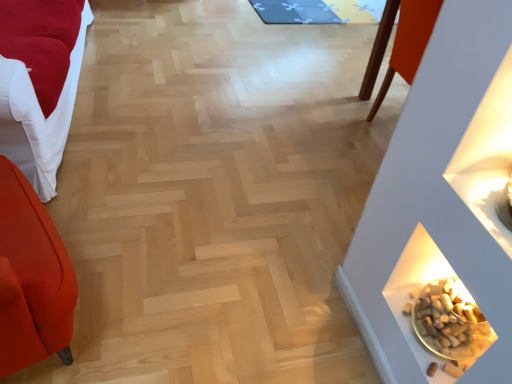
Question: Is point (480, 319) closer or farther from the camera than point (58, 109)?

Choices:
 (A) closer
 (B) farther

Answer: (A)

Question: Would you say brown cork at lower right is inside or outside velvet red sofa at left?

Choices:
 (A) inside
 (B) outside

Answer: (B)

Question: Estimate the real-world distances between objects in this image. Which object is closer to the blue fabric mat at upper center?

Choices:
 (A) velvet red sofa at left
 (B) brown cork at lower right

Answer: (A)

Question: Based on their relative distances, which object is nearer to the brown cork at lower right?

Choices:
 (A) velvet red sofa at left
 (B) blue fabric mat at upper center

Answer: (A)